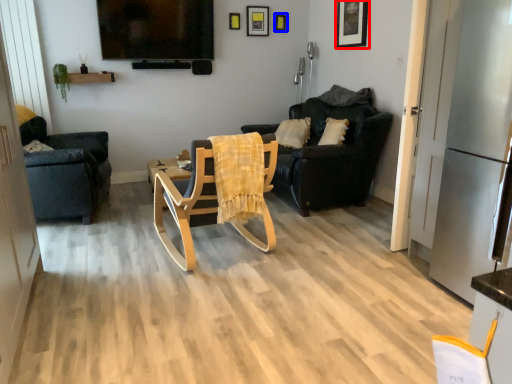
Question: Which object appears closest to the camera in this image, picture frame (highlighted by a red box) or picture frame (highlighted by a blue box)?

Choices:
 (A) picture frame
 (B) picture frame

Answer: (A)